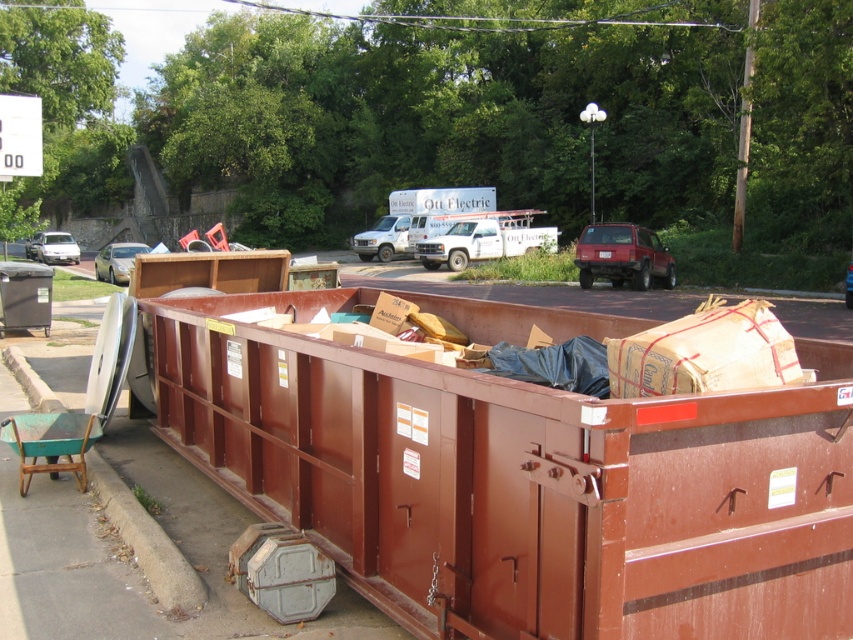
Can you confirm if brown matte container at center is positioned to the left of metallic silver car at center?

Correct, you'll find brown matte container at center to the left of metallic silver car at center.

Locate an element on the screen. This screenshot has height=640, width=853. brown matte container at center is located at coordinates (514, 477).

Is red matte suv at center below matte white car at left?

Yes.

Is red matte suv at center wider than matte white car at left?

No.

Locate an element on the screen. This screenshot has height=640, width=853. red matte suv at center is located at coordinates (622, 257).

Where is `red matte suv at center`? The width and height of the screenshot is (853, 640). red matte suv at center is located at coordinates (622, 257).

Which is in front, point (380, 532) or point (386, 241)?

Point (380, 532) is more forward.

Is point (572, 497) farther from viewer compared to point (363, 230)?

No.

The image size is (853, 640). Identify the location of brown matte container at center. (514, 477).

Where is `brown matte container at center`? brown matte container at center is located at coordinates (514, 477).